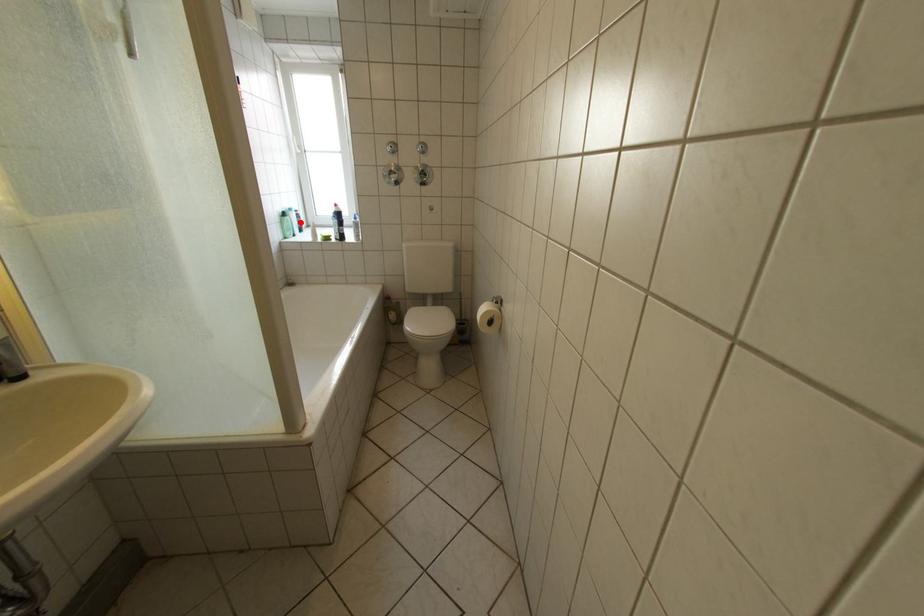
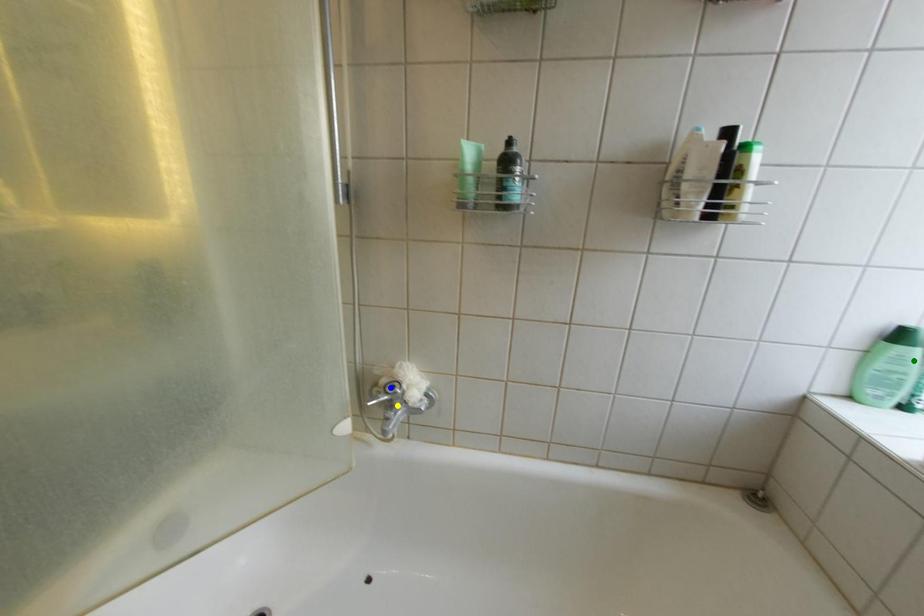
Question: I am providing you with two images of the same scene from different viewpoints. A red point is marked on the first image. You are given multiple points on the second image. Which spot in image 2 lines up with the point in image 1?

Choices:
 (A) yellow point
 (B) blue point
 (C) green point

Answer: (C)